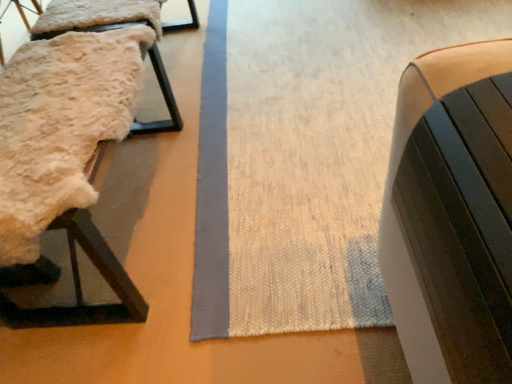
Question: Does fluffy sheepskin at left, positioned as the first furniture in left-to-right order, appear on the left side of matte black bench at right, the first furniture from the front?

Choices:
 (A) yes
 (B) no

Answer: (A)

Question: Can you confirm if fluffy sheepskin at left, marked as the second furniture in a back-to-front arrangement, is shorter than matte black bench at right, which ranks as the 3th furniture in back-to-front order?

Choices:
 (A) no
 (B) yes

Answer: (B)

Question: Does fluffy sheepskin at left, positioned as the first furniture in left-to-right order, come behind matte black bench at right, the 1th furniture in the right-to-left sequence?

Choices:
 (A) yes
 (B) no

Answer: (A)

Question: Is fluffy sheepskin at left, positioned as the first furniture in left-to-right order, wider than matte black bench at right, the 1th furniture in the right-to-left sequence?

Choices:
 (A) no
 (B) yes

Answer: (B)

Question: From a real-world perspective, does fluffy sheepskin at left, positioned as the first furniture in left-to-right order, stand above matte black bench at right, the first furniture from the front?

Choices:
 (A) no
 (B) yes

Answer: (A)

Question: Does point (38, 39) appear closer or farther from the camera than point (381, 221)?

Choices:
 (A) farther
 (B) closer

Answer: (A)

Question: Looking at the image, does fuzzy sheepskin at left, marked as the second furniture in a right-to-left arrangement, seem bigger or smaller compared to matte black bench at right, which ranks as the 3th furniture in back-to-front order?

Choices:
 (A) small
 (B) big

Answer: (B)

Question: Considering the positions of fuzzy sheepskin at left, marked as the 3th furniture in a front-to-back arrangement, and matte black bench at right, which ranks as the 3th furniture in back-to-front order, in the image, is fuzzy sheepskin at left, marked as the 3th furniture in a front-to-back arrangement, taller or shorter than matte black bench at right, which ranks as the 3th furniture in back-to-front order,?

Choices:
 (A) tall
 (B) short

Answer: (A)

Question: Is fuzzy sheepskin at left, marked as the second furniture in a right-to-left arrangement, wider or thinner than matte black bench at right, the first furniture from the front?

Choices:
 (A) wide
 (B) thin

Answer: (A)

Question: Considering the positions of point (454, 178) and point (162, 130), is point (454, 178) closer or farther from the camera than point (162, 130)?

Choices:
 (A) closer
 (B) farther

Answer: (A)

Question: Is matte black bench at right, the first furniture from the front, taller or shorter than fuzzy sheepskin at left, acting as the 1th furniture starting from the back?

Choices:
 (A) tall
 (B) short

Answer: (B)

Question: Is matte black bench at right, which is the 3th furniture in left-to-right order, bigger or smaller than fuzzy sheepskin at left, marked as the second furniture in a right-to-left arrangement?

Choices:
 (A) small
 (B) big

Answer: (A)

Question: In terms of width, does matte black bench at right, which is the 3th furniture in left-to-right order, look wider or thinner when compared to fuzzy sheepskin at left, marked as the second furniture in a right-to-left arrangement?

Choices:
 (A) wide
 (B) thin

Answer: (B)

Question: Would you say matte black bench at right, the first furniture from the front, is to the left or to the right of fluffy sheepskin at left, marked as the second furniture in a back-to-front arrangement, in the picture?

Choices:
 (A) left
 (B) right

Answer: (B)

Question: Considering the positions of matte black bench at right, which is the 3th furniture in left-to-right order, and fluffy sheepskin at left, positioned as the first furniture in left-to-right order, in the image, is matte black bench at right, which is the 3th furniture in left-to-right order, taller or shorter than fluffy sheepskin at left, positioned as the first furniture in left-to-right order,?

Choices:
 (A) tall
 (B) short

Answer: (A)